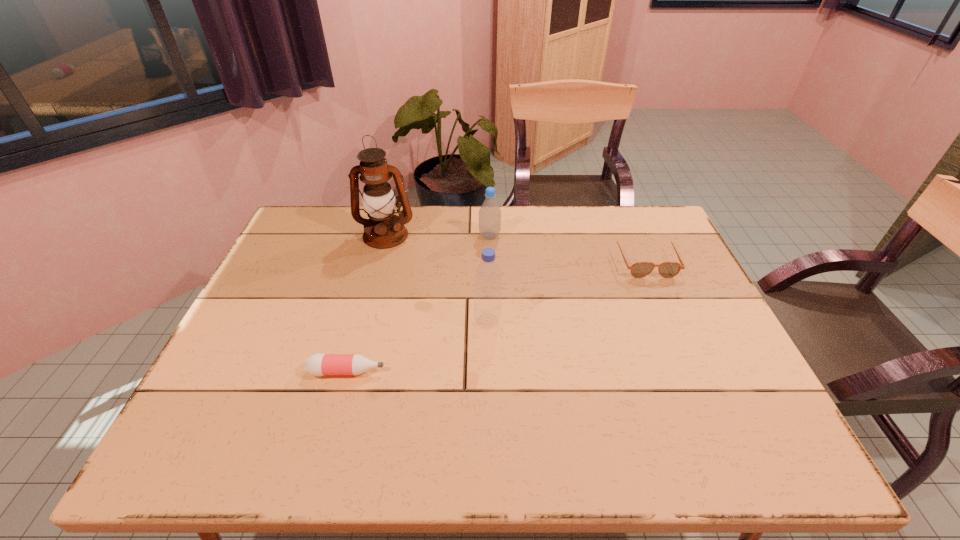
This screenshot has height=540, width=960. What are the coordinates of `the closest object to the second shortest bottle` in the screenshot? It's located at (383, 230).

In order to click on the closest object to the leftmost bottle in this screenshot , I will do `click(488, 276)`.

Find the location of a particular element. the second closest bottle to the lantern is located at coordinates (488, 276).

Locate an element on the screen. This screenshot has height=540, width=960. bottle identified as the closest to the tallest object is located at coordinates (490, 213).

Where is `free spot that satisfies the following two spatial constraints: 1. on the side of the lantern, there is a wick adjustment knob; 2. with the cap open on the shortest bottle`? This screenshot has height=540, width=960. free spot that satisfies the following two spatial constraints: 1. on the side of the lantern, there is a wick adjustment knob; 2. with the cap open on the shortest bottle is located at coordinates (349, 372).

You are a GUI agent. You are given a task and a screenshot of the screen. Output one action in this format:
    pyautogui.click(x=<x>, y=<y>)
    Task: Click on the vacant space that satisfies the following two spatial constraints: 1. on the side of the lantern, there is a wick adjustment knob; 2. with the cap open on the nearest bottle
    The width and height of the screenshot is (960, 540).
    Given the screenshot: What is the action you would take?
    pyautogui.click(x=349, y=372)

What are the coordinates of `vacant region that satisfies the following two spatial constraints: 1. on the side of the tallest bottle, there is a wick adjustment knob; 2. on the right side of the lantern` in the screenshot? It's located at (363, 321).

Identify the location of vacant space that satisfies the following two spatial constraints: 1. on the front-facing side of the rightmost object; 2. with the cap open on the shortest bottle. This screenshot has height=540, width=960. (693, 372).